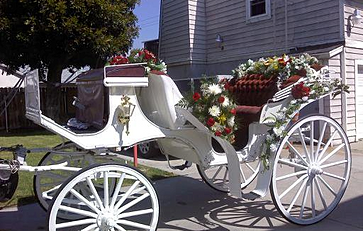
Find the location of `white door`. white door is located at coordinates tap(358, 108).